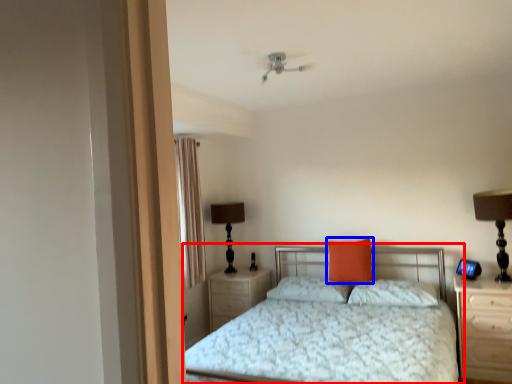
Question: Which object appears closest to the camera in this image, bed (highlighted by a red box) or pillow (highlighted by a blue box)?

Choices:
 (A) bed
 (B) pillow

Answer: (A)